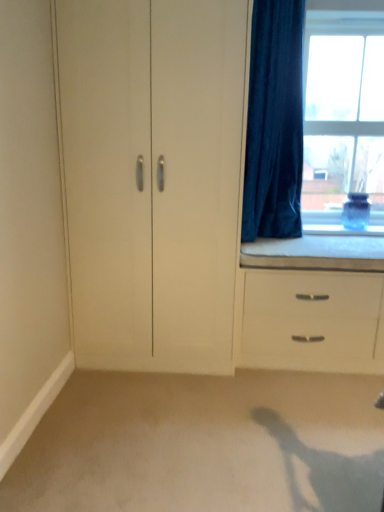
Where is `vacant area on top of beige carpet at lower center (from a real-world perspective)`? This screenshot has height=512, width=384. vacant area on top of beige carpet at lower center (from a real-world perspective) is located at coordinates (221, 437).